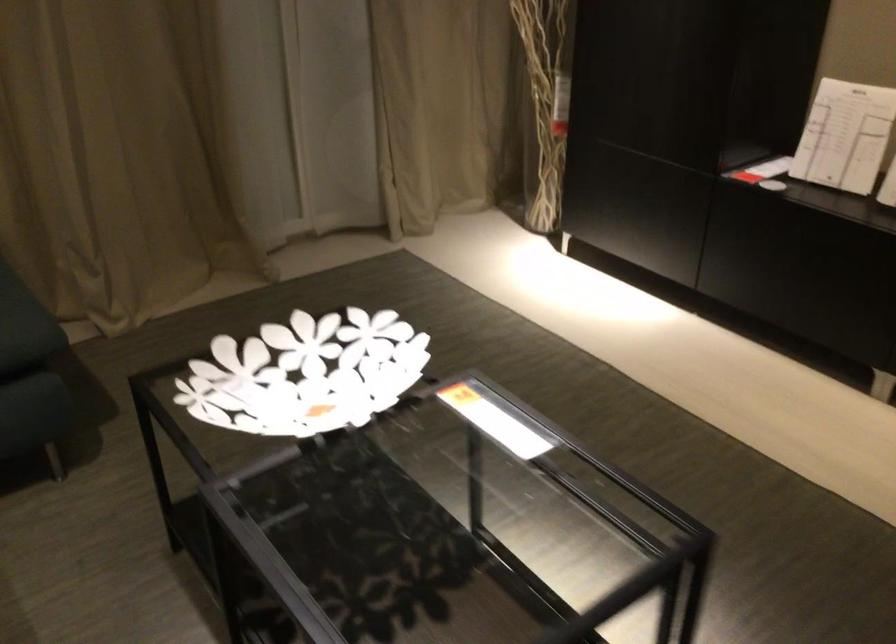
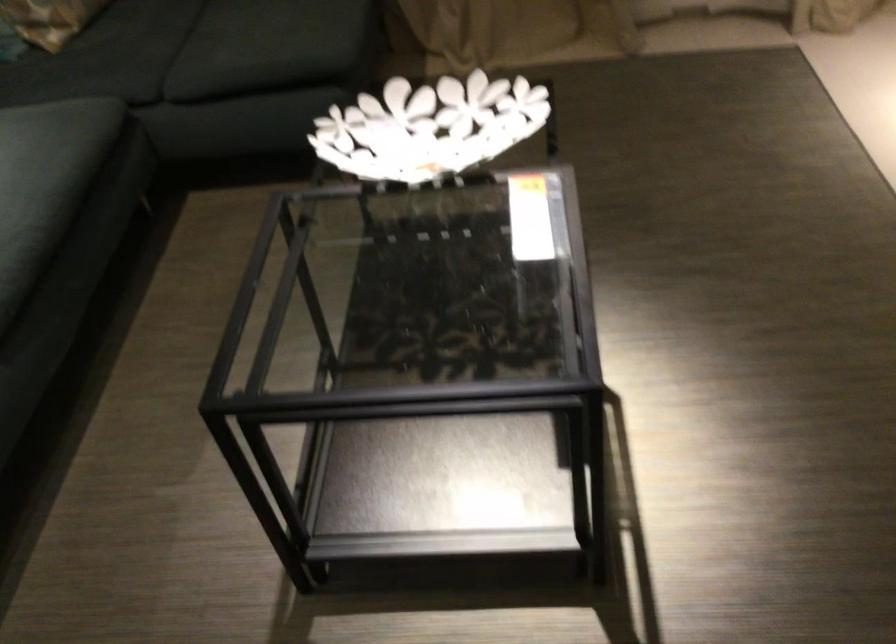
The images are taken continuously from a first-person perspective. In which direction is your viewpoint rotating?

The camera rotated toward left-down.